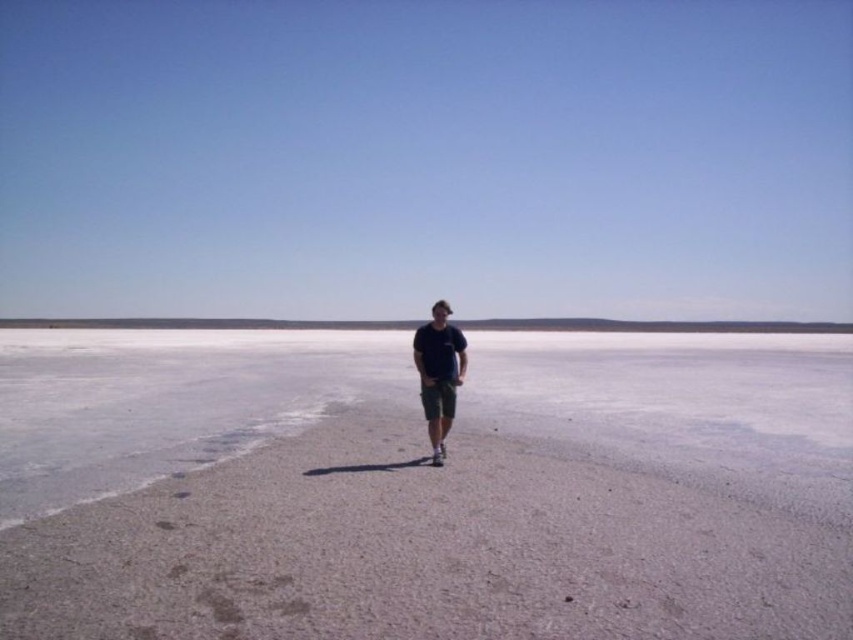
You are standing on the white sand at center and want to walk to the matte dark blue shirt at center. Which direction should you move?

Since the white sand at center is to the left of the matte dark blue shirt at center, you should move to the right to reach the matte dark blue shirt at center.

You are standing at the point closer to the camera in the image. Which point are you at, point (648, 420) or point (444, 392)?

You are at point (648, 420) because it is further to the camera than point (444, 392).

You are standing at the edge of a salt flat and see the white sand at center and the green cotton shorts at center. Which object is nearer to you?

The white sand at center is closer to the viewer than the green cotton shorts at center.